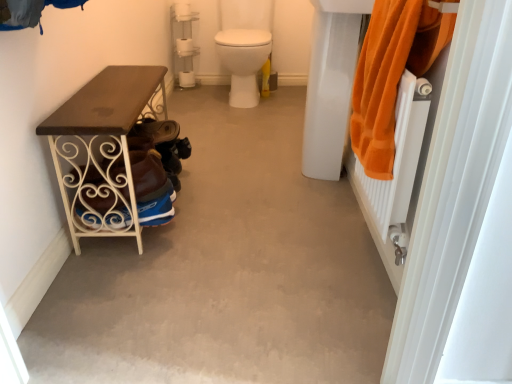
Question: From the image's perspective, does smooth concrete floor at center appear lower than brown suede shoe at lower left?

Choices:
 (A) no
 (B) yes

Answer: (B)

Question: Does smooth concrete floor at center appear on the right side of brown suede shoe at lower left?

Choices:
 (A) no
 (B) yes

Answer: (B)

Question: Would you consider smooth concrete floor at center to be distant from brown suede shoe at lower left?

Choices:
 (A) yes
 (B) no

Answer: (B)

Question: Is smooth concrete floor at center taller than brown suede shoe at lower left?

Choices:
 (A) no
 (B) yes

Answer: (A)

Question: Considering the relative sizes of smooth concrete floor at center and brown suede shoe at lower left in the image provided, is smooth concrete floor at center thinner than brown suede shoe at lower left?

Choices:
 (A) no
 (B) yes

Answer: (A)

Question: Considering their positions, is white glossy toilet at center located in front of or behind brown suede shoe at lower left?

Choices:
 (A) front
 (B) behind

Answer: (B)

Question: Which is correct: white glossy toilet at center is inside brown suede shoe at lower left, or outside of it?

Choices:
 (A) outside
 (B) inside

Answer: (A)

Question: Considering the positions of white glossy toilet at center and brown suede shoe at lower left in the image, is white glossy toilet at center taller or shorter than brown suede shoe at lower left?

Choices:
 (A) short
 (B) tall

Answer: (B)

Question: Is white glossy toilet at center wider or thinner than brown suede shoe at lower left?

Choices:
 (A) wide
 (B) thin

Answer: (A)

Question: Looking at the image, does orange terry cloth towel at right seem bigger or smaller compared to smooth concrete floor at center?

Choices:
 (A) small
 (B) big

Answer: (A)

Question: Considering the positions of orange terry cloth towel at right and smooth concrete floor at center in the image, is orange terry cloth towel at right taller or shorter than smooth concrete floor at center?

Choices:
 (A) short
 (B) tall

Answer: (B)

Question: Looking at their shapes, would you say orange terry cloth towel at right is wider or thinner than smooth concrete floor at center?

Choices:
 (A) thin
 (B) wide

Answer: (A)

Question: Is point (395, 69) closer or farther from the camera than point (290, 261)?

Choices:
 (A) farther
 (B) closer

Answer: (B)

Question: From the image's perspective, relative to white glossy sink at upper right, is white glossy toilet at center above or below?

Choices:
 (A) below
 (B) above

Answer: (B)

Question: Is white glossy toilet at center situated inside white glossy sink at upper right or outside?

Choices:
 (A) outside
 (B) inside

Answer: (A)